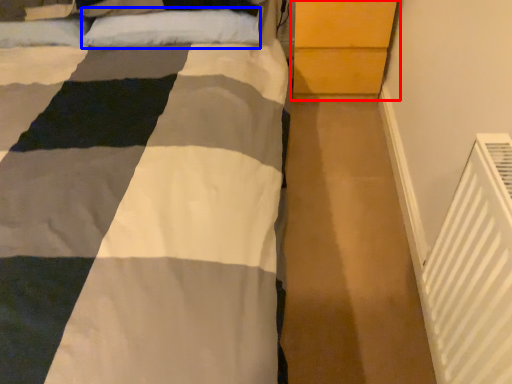
Question: Which object appears closest to the camera in this image, dresser (highlighted by a red box) or pillow (highlighted by a blue box)?

Choices:
 (A) dresser
 (B) pillow

Answer: (B)